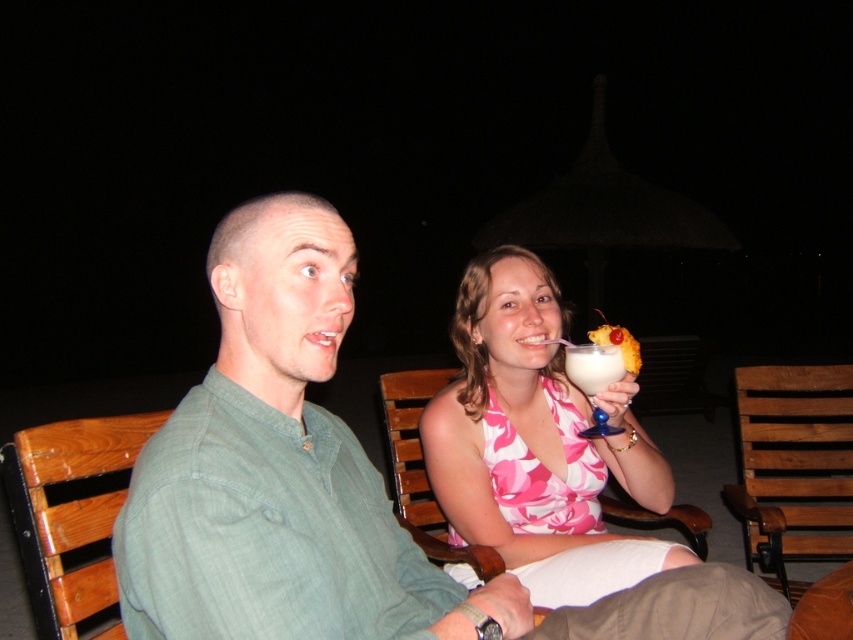
Does point (636, 547) come farther from viewer compared to point (584, 436)?

No, (636, 547) is in front of (584, 436).

Between point (656, 467) and point (616, 372), which one is positioned behind?

The point (656, 467) is more distant.

Is point (532, 289) less distant than point (601, 342)?

No, (532, 289) is behind (601, 342).

Where is `pink floral dress at center`? pink floral dress at center is located at coordinates (537, 444).

Is green matte shirt at center positioned before white frothy drink at upper center?

That is True.

Who is more forward, (277, 529) or (627, 342)?

Point (277, 529) is more forward.

What do you see at coordinates (329, 488) in the screenshot?
I see `green matte shirt at center` at bounding box center [329, 488].

At what (x,y) coordinates should I click in order to perform the action: click on green matte shirt at center. Please return your answer as a coordinate pair (x, y). Looking at the image, I should click on (329, 488).

From the picture: Which of these two, green matte shirt at center or pink floral dress at center, stands taller?

pink floral dress at center is taller.

Who is shorter, green matte shirt at center or pink floral dress at center?

green matte shirt at center

Locate an element on the screen. green matte shirt at center is located at coordinates (329, 488).